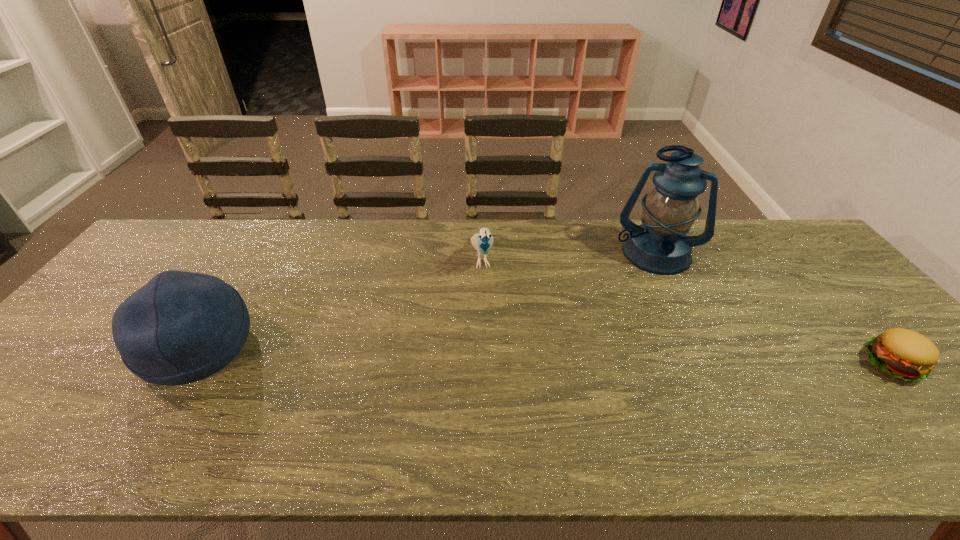
Where is `free space on the desktop that is between the third shortest object and the rightmost object and is positioned at the face of the bird`? This screenshot has width=960, height=540. free space on the desktop that is between the third shortest object and the rightmost object and is positioned at the face of the bird is located at coordinates (498, 353).

Where is `vacant spot on the desktop that is between the second tallest object and the shortest object and is positioned on the face of the tallest object`? vacant spot on the desktop that is between the second tallest object and the shortest object and is positioned on the face of the tallest object is located at coordinates pos(633,356).